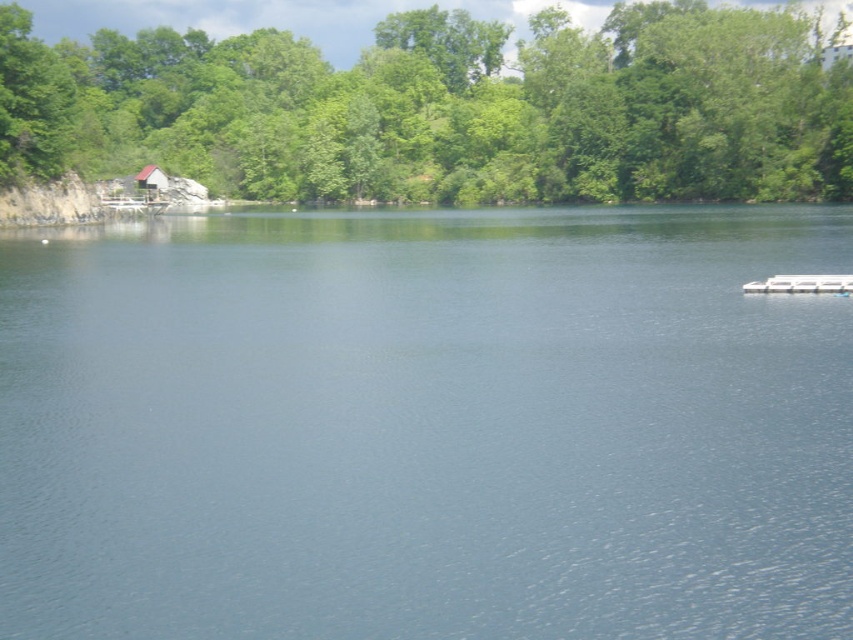
Is green leafy trees at upper center smaller than brown wooden hut at upper left?

No.

Between green leafy trees at upper center and brown wooden hut at upper left, which one has more height?

green leafy trees at upper center

Is point (796, 118) in front of point (154, 186)?

Yes, it is.

Image resolution: width=853 pixels, height=640 pixels. What are the coordinates of `green leafy trees at upper center` in the screenshot? It's located at (450, 108).

Does point (608, 465) come closer to viewer compared to point (601, 29)?

Yes, point (608, 465) is closer to viewer.

Describe the element at coordinates (427, 426) in the screenshot. I see `clear water at center` at that location.

Find the location of a particular element. The width and height of the screenshot is (853, 640). clear water at center is located at coordinates (427, 426).

Which is behind, point (483, 492) or point (148, 170)?

The point (148, 170) is behind.

Can you confirm if clear water at center is taller than brown wooden hut at upper left?

Indeed, clear water at center has a greater height compared to brown wooden hut at upper left.

This screenshot has height=640, width=853. I want to click on clear water at center, so click(x=427, y=426).